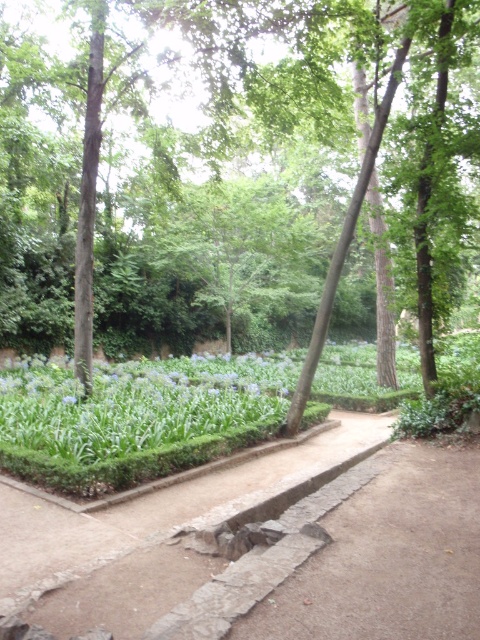
Question: Does brown wood tree at center have a smaller size compared to blue matte flower at center?

Choices:
 (A) yes
 (B) no

Answer: (B)

Question: Does brown wood tree at center appear on the right side of blue matte flower at center?

Choices:
 (A) no
 (B) yes

Answer: (B)

Question: Which point is farther to the camera?

Choices:
 (A) (72, 400)
 (B) (216, 275)

Answer: (B)

Question: Which point is farther from the camera taking this photo?

Choices:
 (A) (73, 403)
 (B) (22, 44)

Answer: (B)

Question: Which point is farther to the camera?

Choices:
 (A) brown wood tree at center
 (B) blue matte flower at center

Answer: (B)

Question: Does brown wood tree at center appear under blue matte flower at center?

Choices:
 (A) no
 (B) yes

Answer: (A)